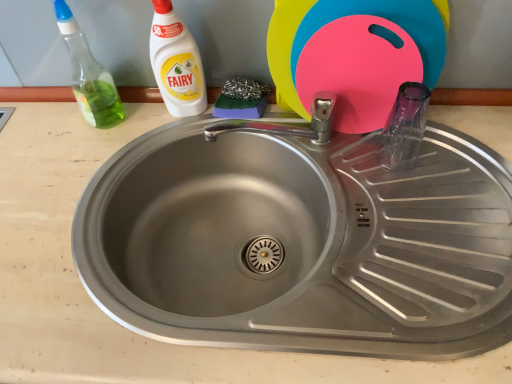
The width and height of the screenshot is (512, 384). I want to click on vacant area to the left of transparent glass bottle at right, so click(348, 163).